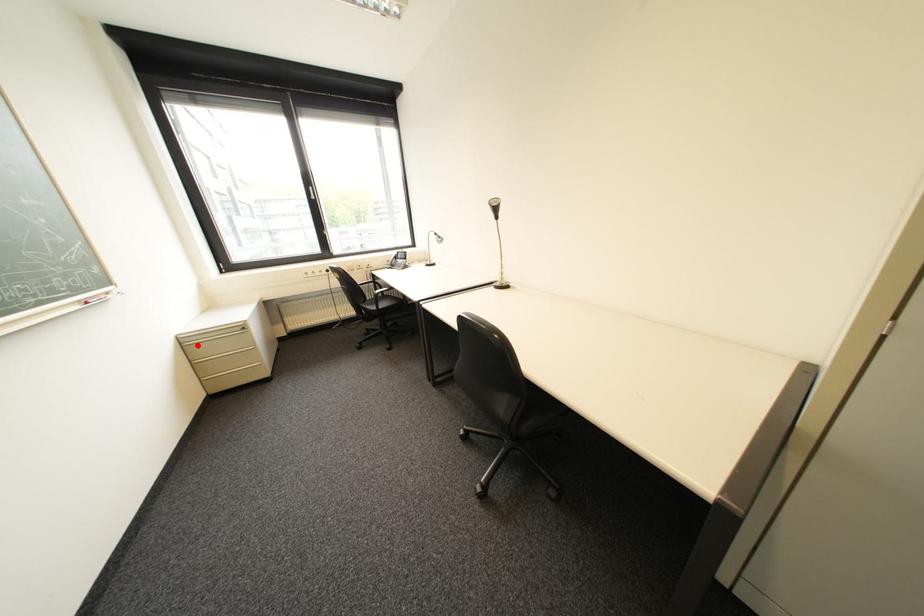
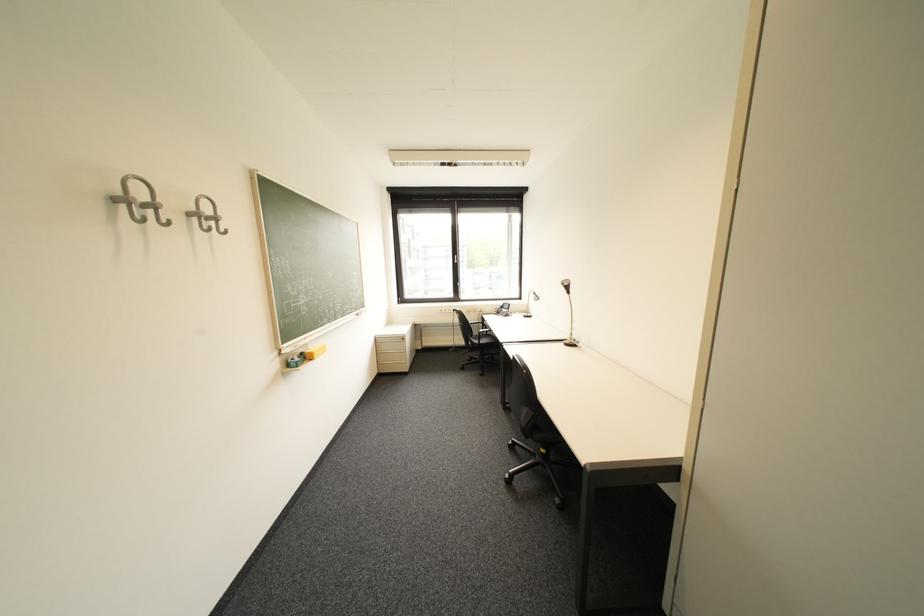
Question: I am providing you with two images of the same scene from different viewpoints. Image1 has a red point marked. In image2, the corresponding 3D location appears at what relative position? Reply with the corresponding letter.

Choices:
 (A) Closer
 (B) Farther

Answer: (B)